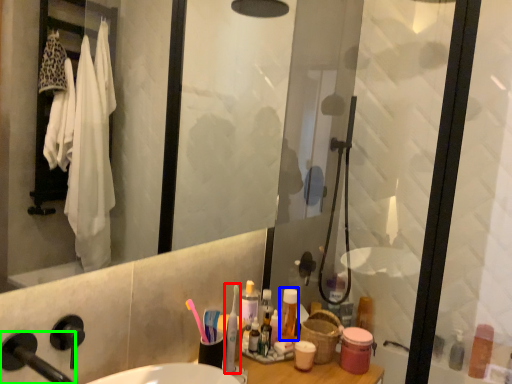
Question: Considering the real-world distances, which object is closest to toothbrush (highlighted by a red box)? toiletry (highlighted by a blue box) or faucet (highlighted by a green box).

Choices:
 (A) toiletry
 (B) faucet

Answer: (A)